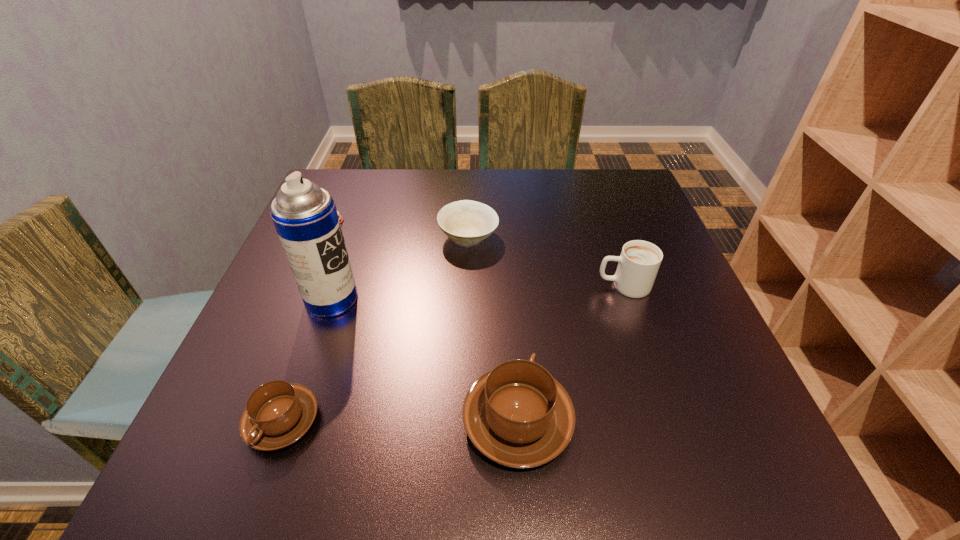
Identify the location of the shortest cappuccino. (278, 413).

Find the location of a particular element. the second cappuccino from left to right is located at coordinates (517, 415).

Locate an element on the screen. the shortest object is located at coordinates (346, 218).

At what (x,y) coordinates should I click in order to perform the action: click on bowl. Please return your answer as a coordinate pair (x, y). This screenshot has width=960, height=540. Looking at the image, I should click on (466, 222).

You are a GUI agent. You are given a task and a screenshot of the screen. Output one action in this format:
    pyautogui.click(x=<x>, y=<y>)
    Task: Click on the tallest object
    
    Given the screenshot: What is the action you would take?
    pyautogui.click(x=305, y=216)

Where is `the rightmost cappuccino`? This screenshot has width=960, height=540. the rightmost cappuccino is located at coordinates (638, 264).

You are a GUI agent. You are given a task and a screenshot of the screen. Output one action in this format:
    pyautogui.click(x=<x>, y=<y>)
    Task: Click on the farthest cappuccino
    
    Given the screenshot: What is the action you would take?
    pyautogui.click(x=638, y=264)

What are the coordinates of `free space located on the side of the second cappuccino from right to left with the handle` in the screenshot? It's located at (507, 259).

The height and width of the screenshot is (540, 960). Find the location of `free space located 0.130m on the side of the second cappuccino from right to left with the handle`. free space located 0.130m on the side of the second cappuccino from right to left with the handle is located at coordinates (511, 320).

At what (x,y) coordinates should I click in order to perform the action: click on blank space located on the side of the second cappuccino from right to left with the handle. Please return your answer as a coordinate pair (x, y). This screenshot has width=960, height=540. Looking at the image, I should click on (511, 324).